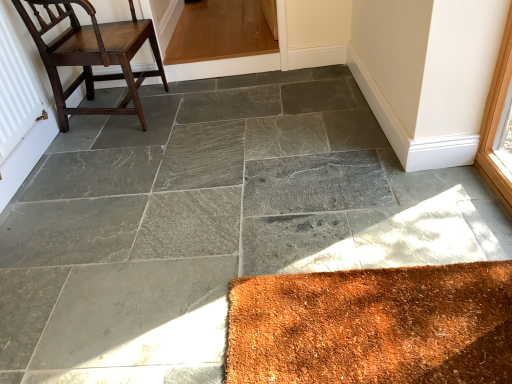
This screenshot has height=384, width=512. What do you see at coordinates (16, 88) in the screenshot?
I see `white textured radiator at left` at bounding box center [16, 88].

Where is `white textured radiator at left`? The width and height of the screenshot is (512, 384). white textured radiator at left is located at coordinates (16, 88).

Find the location of a particular element. dark brown wood chair at left is located at coordinates (92, 55).

The height and width of the screenshot is (384, 512). Describe the element at coordinates (92, 55) in the screenshot. I see `dark brown wood chair at left` at that location.

Locate an element on the screen. This screenshot has width=512, height=384. white textured radiator at left is located at coordinates (16, 88).

In the image, is dark brown wood chair at left on the left side or the right side of white textured radiator at left?

dark brown wood chair at left is to the right of white textured radiator at left.

Which object is closer to the camera taking this photo, dark brown wood chair at left or white textured radiator at left?

Positioned in front is white textured radiator at left.

Which point is more distant from viewer, (57, 10) or (11, 111)?

The point (57, 10) is farther.

From the image's perspective, which one is positioned lower, dark brown wood chair at left or white textured radiator at left?

white textured radiator at left appears lower in the image.

Looking at this image, from a real-world perspective, between dark brown wood chair at left and white textured radiator at left, who is vertically higher?

In real-world perspective, white textured radiator at left is above.

Looking at their sizes, would you say dark brown wood chair at left is wider or thinner than white textured radiator at left?

dark brown wood chair at left is wider than white textured radiator at left.

Considering the relative sizes of dark brown wood chair at left and white textured radiator at left in the image provided, is dark brown wood chair at left taller than white textured radiator at left?

Indeed, dark brown wood chair at left has a greater height compared to white textured radiator at left.

Does dark brown wood chair at left have a larger size compared to white textured radiator at left?

Yes.

Would you say white textured radiator at left is part of dark brown wood chair at left's contents?

That's incorrect, white textured radiator at left is not inside dark brown wood chair at left.

Are dark brown wood chair at left and white textured radiator at left far apart?

No, dark brown wood chair at left is in close proximity to white textured radiator at left.

Is dark brown wood chair at left looking in the opposite direction of white textured radiator at left?

No, dark brown wood chair at left is not facing away from white textured radiator at left.

Locate an element on the screen. chair below the white textured radiator at left (from a real-world perspective) is located at coordinates (92, 55).

Based on the photo, between white textured radiator at left and dark brown wood chair at left, which one appears on the left side from the viewer's perspective?

white textured radiator at left.

Considering the relative positions of white textured radiator at left and dark brown wood chair at left in the image provided, is white textured radiator at left behind dark brown wood chair at left?

No, white textured radiator at left is in front of dark brown wood chair at left.

Which point is more distant from viewer, (10, 83) or (62, 0)?

The point (62, 0) is farther.

From the image's perspective, is white textured radiator at left on dark brown wood chair at left?

No, from the image's perspective, white textured radiator at left is not over dark brown wood chair at left.

From a real-world perspective, is white textured radiator at left positioned under dark brown wood chair at left based on gravity?

Incorrect, from a real-world perspective, white textured radiator at left is higher than dark brown wood chair at left.

Which object is wider, white textured radiator at left or dark brown wood chair at left?

dark brown wood chair at left is wider.

Considering the sizes of objects white textured radiator at left and dark brown wood chair at left in the image provided, who is shorter, white textured radiator at left or dark brown wood chair at left?

white textured radiator at left is shorter.

Considering the relative sizes of white textured radiator at left and dark brown wood chair at left in the image provided, is white textured radiator at left smaller than dark brown wood chair at left?

Yes.

Would you say white textured radiator at left is outside dark brown wood chair at left?

white textured radiator at left is positioned outside dark brown wood chair at left.

Is white textured radiator at left not close to dark brown wood chair at left?

No, white textured radiator at left is not far away from dark brown wood chair at left.

Is white textured radiator at left turned away from dark brown wood chair at left?

No, white textured radiator at left is not facing the opposite direction of dark brown wood chair at left.

What's the angular difference between white textured radiator at left and dark brown wood chair at left's facing directions?

The angular difference between white textured radiator at left and dark brown wood chair at left is 1.58 degrees.

The image size is (512, 384). I want to click on chair above the white textured radiator at left (from the image's perspective), so click(92, 55).

This screenshot has width=512, height=384. Identify the location of chair to the right of white textured radiator at left. (92, 55).

You are a GUI agent. You are given a task and a screenshot of the screen. Output one action in this format:
    pyautogui.click(x=<x>, y=<y>)
    Task: Click on the radiator above the dark brown wood chair at left (from a real-world perspective)
    
    Given the screenshot: What is the action you would take?
    pyautogui.click(x=16, y=88)